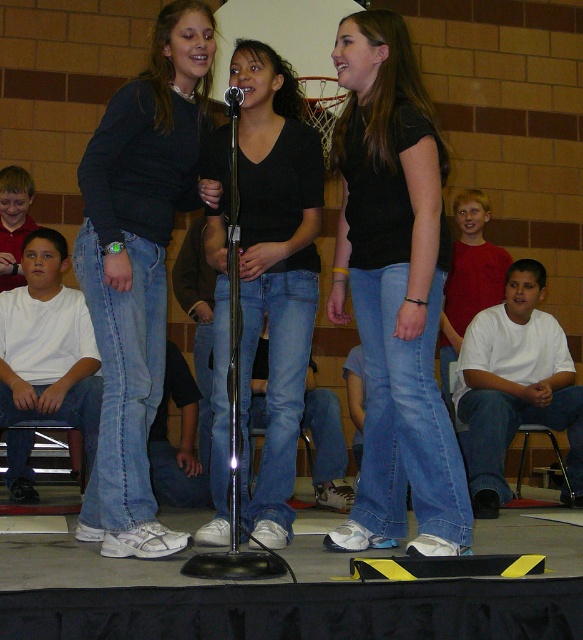
Question: Among these points, which one is farthest from the camera?

Choices:
 (A) (293, 84)
 (B) (83, 305)
 (C) (205, 182)

Answer: (B)

Question: Which is farther from the red matte shirt at lower right?

Choices:
 (A) matte black sweater at center
 (B) black matte jeans at center
 (C) white cotton shirt at lower left
 (D) black matte shirt at center

Answer: (A)

Question: Is black matte shirt at center below matte black sweater at center?

Choices:
 (A) no
 (B) yes

Answer: (B)

Question: From the image, what is the correct spatial relationship of black matte shirt at center in relation to metallic silver microphone at center?

Choices:
 (A) left
 (B) right

Answer: (B)

Question: Considering the real-world distances, which object is closest to the red matte shirt at lower right?

Choices:
 (A) matte red shirt at left
 (B) matte black sweater at center
 (C) metallic silver microphone at center
 (D) black matte jeans at center

Answer: (D)

Question: Does matte black sweater at center appear on the right side of red matte shirt at lower right?

Choices:
 (A) yes
 (B) no

Answer: (B)